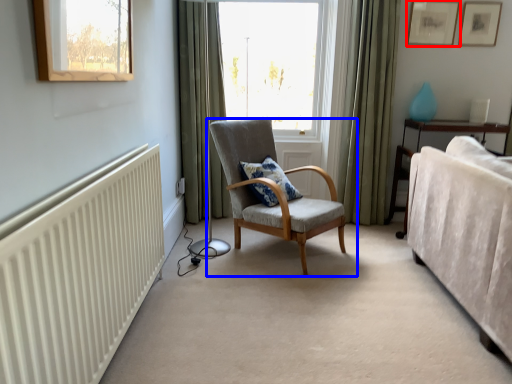
Question: Which point is further to the camera, picture frame (highlighted by a red box) or chair (highlighted by a blue box)?

Choices:
 (A) picture frame
 (B) chair

Answer: (A)